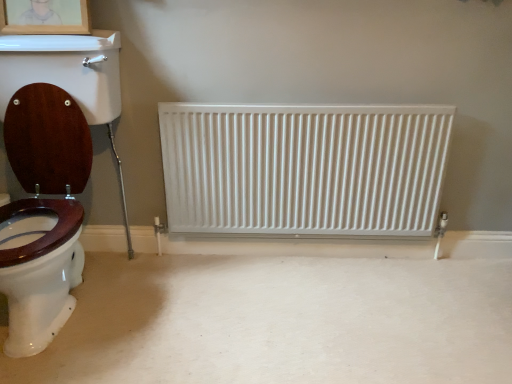
Identify the location of free space underneath white matte radiator at center (from a real-world perspective). This screenshot has height=384, width=512. (260, 251).